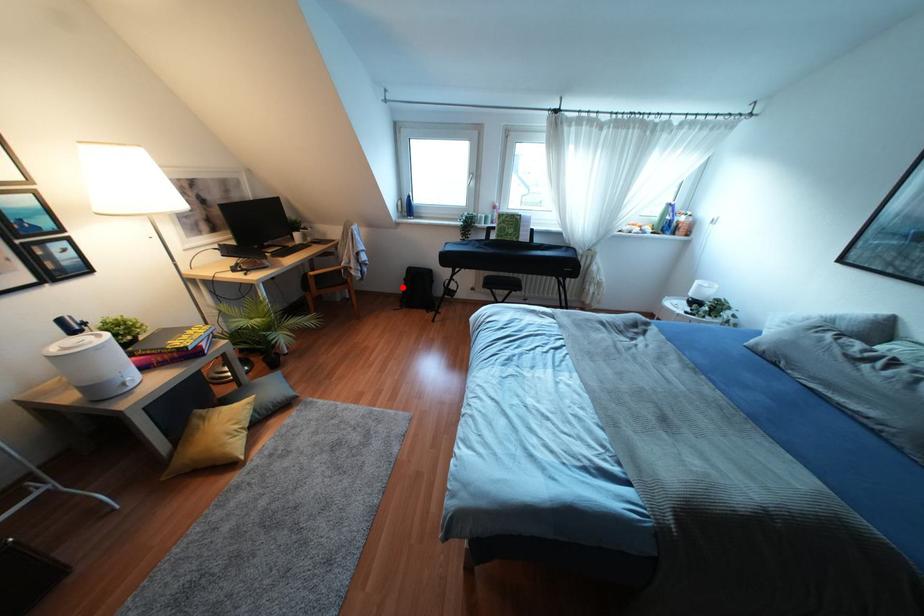
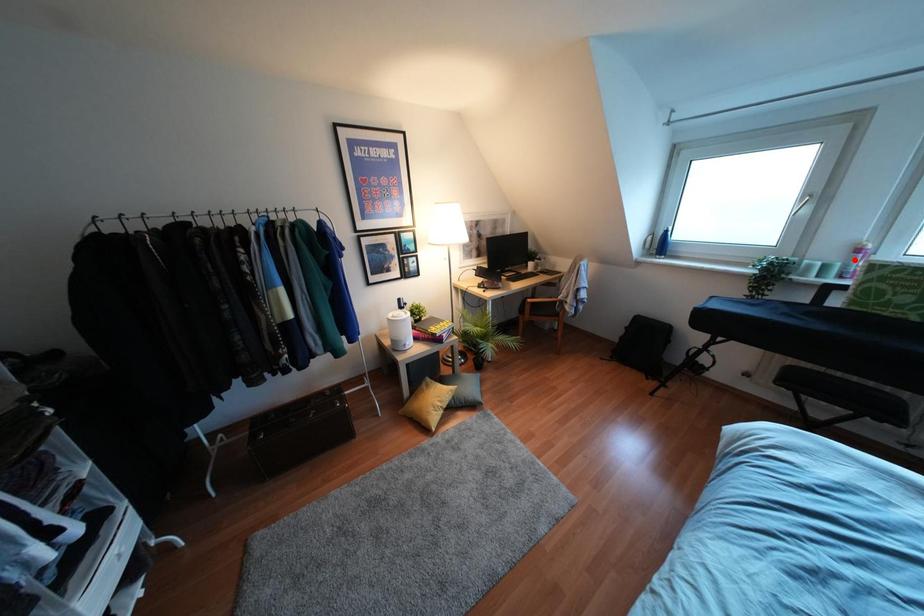
I am providing you with two images of the same scene from different viewpoints. A red point is marked on the first image and another point is marked on the second image. Is the marked point in image1 the same physical position as the marked point in image2?

No